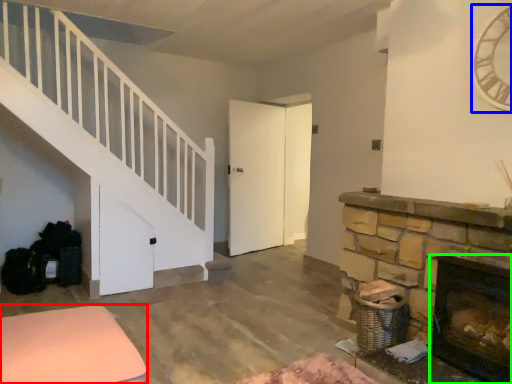
Question: Considering the real-world distances, which object is farthest from furniture (highlighted by a red box)? clock (highlighted by a blue box) or fireplace (highlighted by a green box)?

Choices:
 (A) clock
 (B) fireplace

Answer: (A)